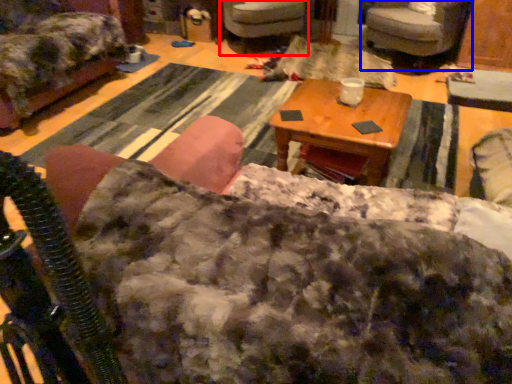
Question: Which of the following is the farthest to the observer, chair (highlighted by a red box) or chair (highlighted by a blue box)?

Choices:
 (A) chair
 (B) chair

Answer: (A)